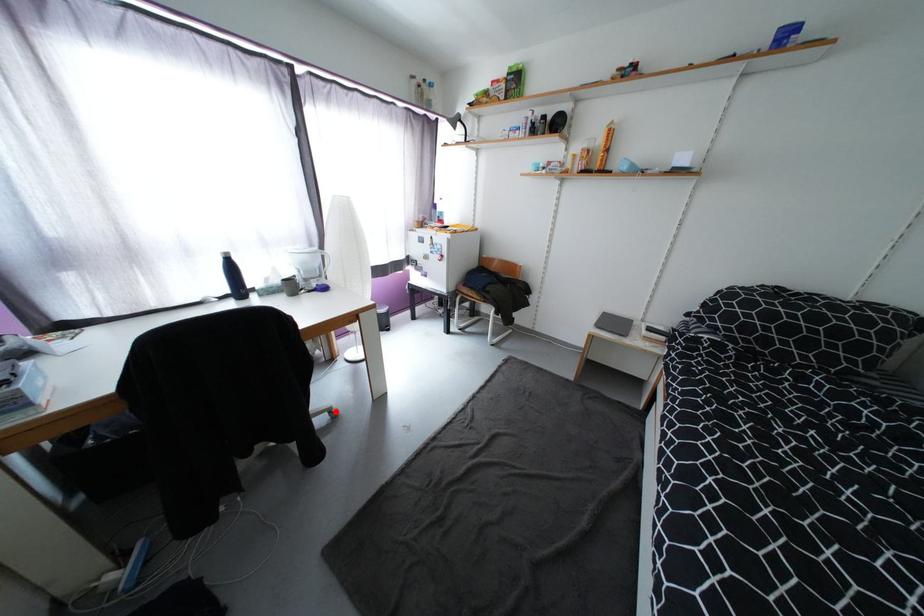
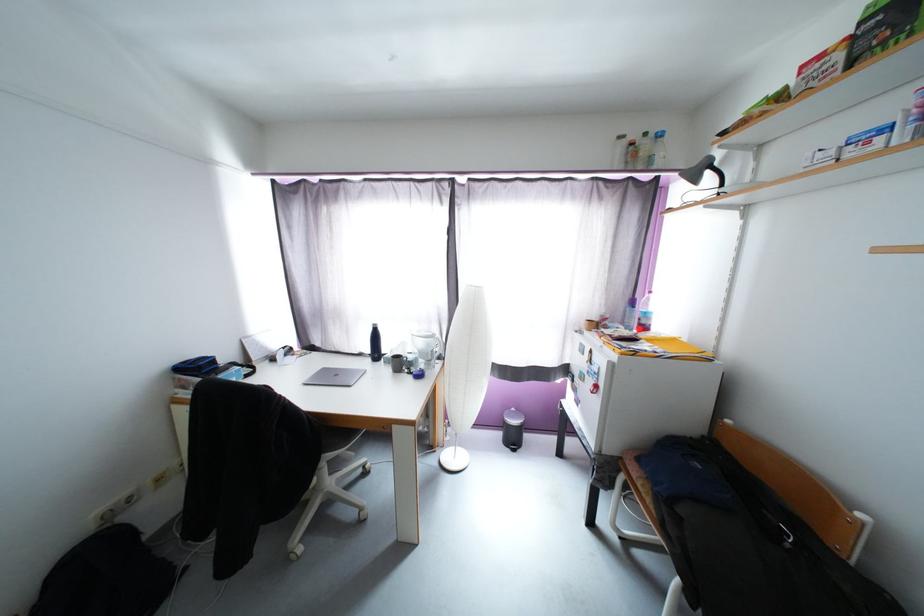
In the second image, find the point that corresponds to the highlighted location in the first image.

(367, 511)